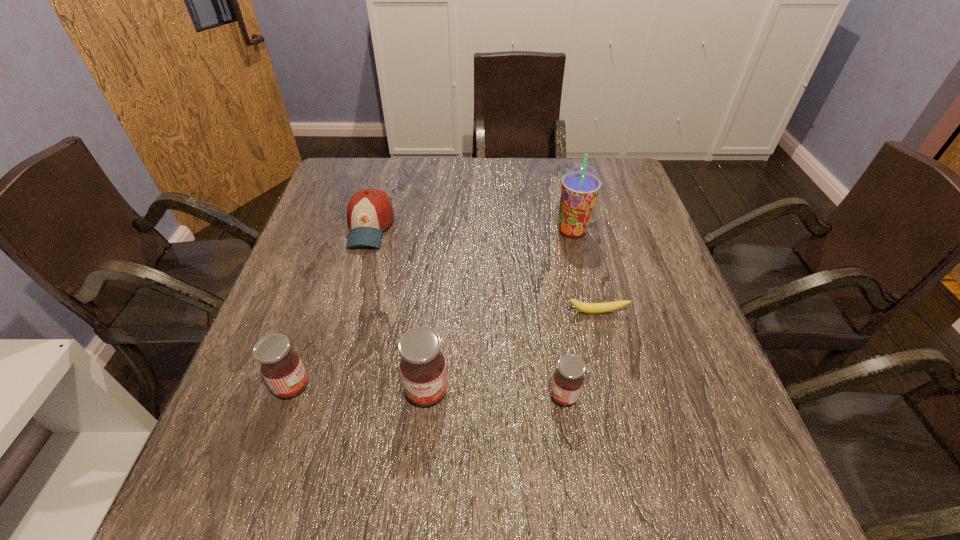
This screenshot has width=960, height=540. Find the location of `the fourth shortest object`. the fourth shortest object is located at coordinates (280, 365).

Identify the location of the leftmost jam. (280, 365).

Locate an element on the screen. This screenshot has height=540, width=960. the third object from left to right is located at coordinates (423, 370).

The height and width of the screenshot is (540, 960). I want to click on the tallest jam, so click(423, 370).

In order to click on the fourth object from left to right in this screenshot , I will do `click(568, 379)`.

Locate an element on the screen. the shortest jam is located at coordinates (568, 379).

The image size is (960, 540). What are the coordinates of `the tallest object` in the screenshot? It's located at (580, 186).

Where is `baseball cap`? The image size is (960, 540). baseball cap is located at coordinates (369, 212).

Locate an element on the screen. The width and height of the screenshot is (960, 540). the shortest object is located at coordinates (591, 308).

Locate an element on the screen. This screenshot has height=540, width=960. banana is located at coordinates pos(591,308).